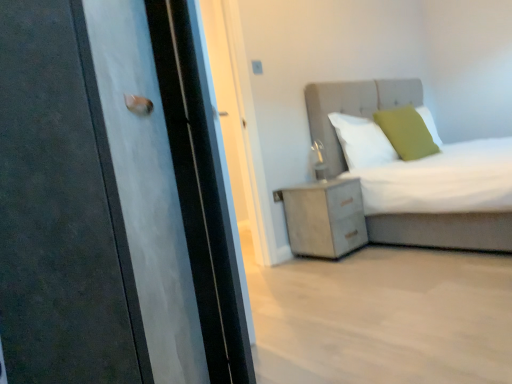
Question: Does matte black door at left have a greater width compared to matte gray bed at upper right?

Choices:
 (A) no
 (B) yes

Answer: (A)

Question: Is matte gray bed at upper right surrounded by matte black door at left?

Choices:
 (A) yes
 (B) no

Answer: (B)

Question: From a real-world perspective, is matte black door at left located higher than matte gray bed at upper right?

Choices:
 (A) yes
 (B) no

Answer: (A)

Question: Is matte black door at left to the left of matte gray bed at upper right from the viewer's perspective?

Choices:
 (A) yes
 (B) no

Answer: (A)

Question: From the image's perspective, would you say matte black door at left is positioned over matte gray bed at upper right?

Choices:
 (A) no
 (B) yes

Answer: (A)

Question: Is matte black door at left closer to the viewer compared to matte gray bed at upper right?

Choices:
 (A) no
 (B) yes

Answer: (B)

Question: Is matte gray bed at upper right taller than matte black door at left?

Choices:
 (A) no
 (B) yes

Answer: (A)

Question: Is matte gray bed at upper right smaller than matte black door at left?

Choices:
 (A) yes
 (B) no

Answer: (B)

Question: From a real-world perspective, is matte gray bed at upper right below matte black door at left?

Choices:
 (A) yes
 (B) no

Answer: (A)

Question: From the image's perspective, is matte gray bed at upper right located beneath matte black door at left?

Choices:
 (A) yes
 (B) no

Answer: (B)

Question: Does matte gray bed at upper right have a larger size compared to matte black door at left?

Choices:
 (A) yes
 (B) no

Answer: (A)

Question: Is matte gray bed at upper right touching matte black door at left?

Choices:
 (A) no
 (B) yes

Answer: (A)

Question: Can you confirm if matte black door at left is taller than white soft pillow at upper center, positioned as the 2th pillow in right-to-left order?

Choices:
 (A) yes
 (B) no

Answer: (A)